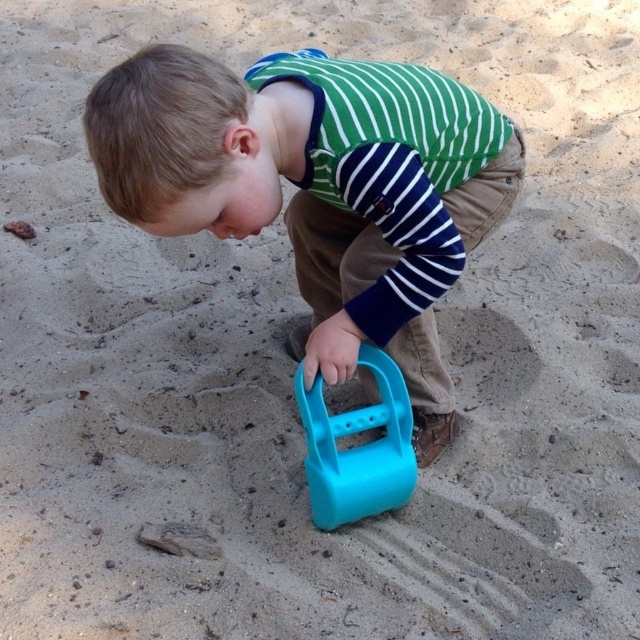
Is matte plastic shovel at center wider than blue plastic shovel at center?

Indeed, matte plastic shovel at center has a greater width compared to blue plastic shovel at center.

Is matte plastic shovel at center smaller than blue plastic shovel at center?

No, matte plastic shovel at center is not smaller than blue plastic shovel at center.

The height and width of the screenshot is (640, 640). Describe the element at coordinates (320, 189) in the screenshot. I see `matte plastic shovel at center` at that location.

Locate an element on the screen. This screenshot has width=640, height=640. matte plastic shovel at center is located at coordinates (320, 189).